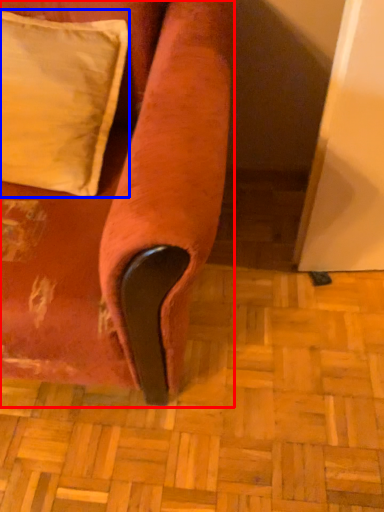
Question: Which point is further to the camera, furniture (highlighted by a red box) or pillow (highlighted by a blue box)?

Choices:
 (A) furniture
 (B) pillow

Answer: (B)